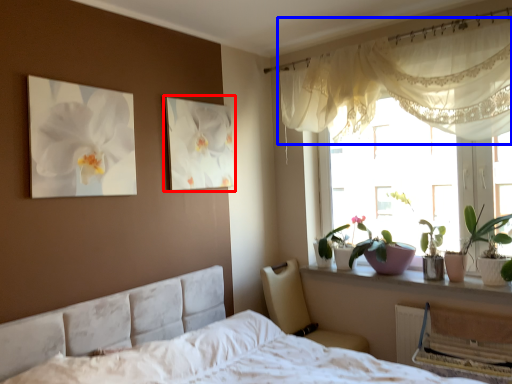
Question: Which point is further to the camera, picture frame (highlighted by a red box) or curtain (highlighted by a blue box)?

Choices:
 (A) picture frame
 (B) curtain

Answer: (A)